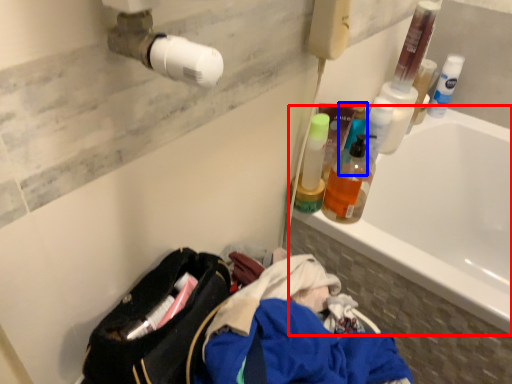
Question: Which of the following is the closest to the observer, bathtub (highlighted by a red box) or cleaning product (highlighted by a blue box)?

Choices:
 (A) bathtub
 (B) cleaning product

Answer: (A)